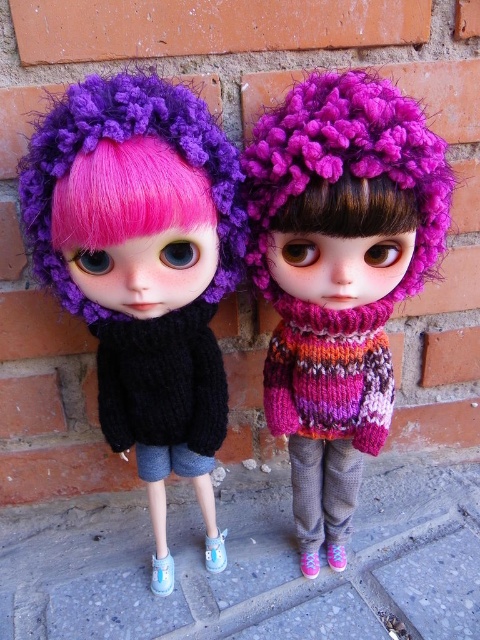
You are organizing a doll display and need to ensure that the fuzzy pink knit hat at center and the purple knitted hat at upper center are visible to visitors. Since space is limited, which hat should you prioritize placing in a more prominent position to accommodate its size?

The fuzzy pink knit hat at center is bigger than the purple knitted hat at upper center, so you should prioritize placing the fuzzy pink knit hat at center in a more prominent position to accommodate its larger size.

You are a photographer setting up a shoot with two dolls against a brick wall. You need to position a spotlight so it shines directly on the fuzzy pink knit hat at center and the fuzzy pink hair at center. Since the spotlight can only illuminate one area at a time, which object should you aim it at first if you want to capture both in the same frame without moving the spotlight?

You should aim the spotlight at the fuzzy pink knit hat at center first because it is located to the left of the fuzzy pink hair at center, so by positioning the spotlight on the hat, you can ensure both objects are illuminated in the same frame without needing to move it.

In the scene shown: You are standing in front of the two dolls against the brick wall. You see the point at coordinates point (345, 211) and the point at coordinates point (385, 224). Which of these points is closer to you?

Point (345, 211) is in front of point (385, 224), so it is closer to you.